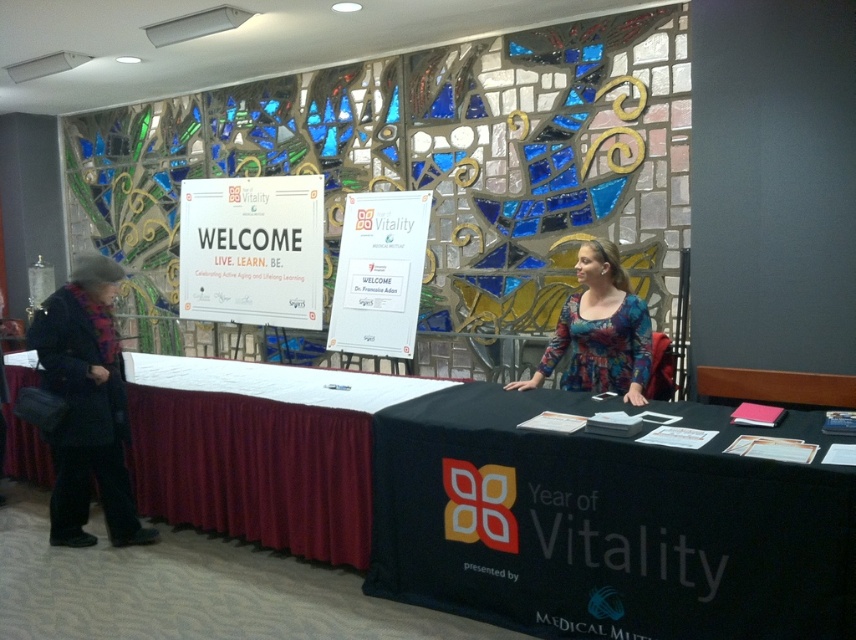
Between dark wool coat at left and multicolored fabric blouse at center, which one has more height?

dark wool coat at left is taller.

Is dark wool coat at left wider than multicolored fabric blouse at center?

Incorrect, dark wool coat at left's width does not surpass multicolored fabric blouse at center's.

Where is `dark wool coat at left`? dark wool coat at left is located at coordinates (87, 404).

At what (x,y) coordinates should I click in order to perform the action: click on dark wool coat at left. Please return your answer as a coordinate pair (x, y). The width and height of the screenshot is (856, 640). Looking at the image, I should click on (87, 404).

How much distance is there between white paper sign at center and dark wool coat at left?

1.66 meters

Based on the photo, can you confirm if white paper sign at center is wider than dark wool coat at left?

Yes, white paper sign at center is wider than dark wool coat at left.

Is point (233, 307) positioned in front of point (64, 428)?

No, (233, 307) is behind (64, 428).

Image resolution: width=856 pixels, height=640 pixels. I want to click on white paper sign at center, so click(x=253, y=250).

The image size is (856, 640). What do you see at coordinates (260, 451) in the screenshot?
I see `white cloth at lower left` at bounding box center [260, 451].

Does white cloth at lower left have a greater width compared to white paper sign at center?

Indeed, white cloth at lower left has a greater width compared to white paper sign at center.

Between point (324, 554) and point (302, 276), which one is positioned behind?

Point (302, 276)

Find the location of a particular element. The height and width of the screenshot is (640, 856). white cloth at lower left is located at coordinates (260, 451).